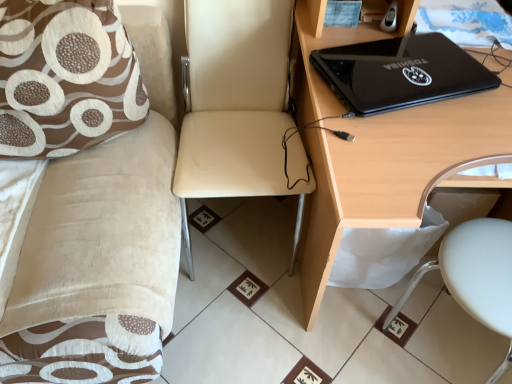
Question: From their relative heights in the image, would you say beige fabric couch at upper left is taller or shorter than black glossy laptop at upper right?

Choices:
 (A) tall
 (B) short

Answer: (A)

Question: In terms of width, does beige fabric couch at upper left look wider or thinner when compared to black glossy laptop at upper right?

Choices:
 (A) wide
 (B) thin

Answer: (A)

Question: Which is farther from the white plastic swivel chair at lower right?

Choices:
 (A) brown fabric pillow at left
 (B) beige fabric couch at upper left
 (C) beige leather chair at center
 (D) black glossy laptop at upper right
 (E) black glossy laptop at upper right

Answer: (A)

Question: Considering the real-world distances, which object is farthest from the beige leather chair at center?

Choices:
 (A) black glossy laptop at upper right
 (B) white plastic swivel chair at lower right
 (C) black glossy laptop at upper right
 (D) beige fabric couch at upper left
 (E) brown fabric pillow at left

Answer: (B)